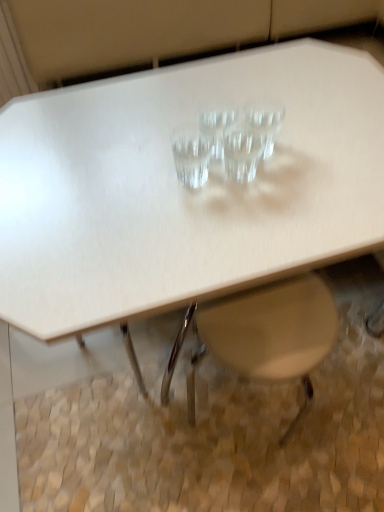
Identify the location of vacant area on the back side of transparent glass martini glass at center, acting as the first martini glass starting from the left. (193, 119).